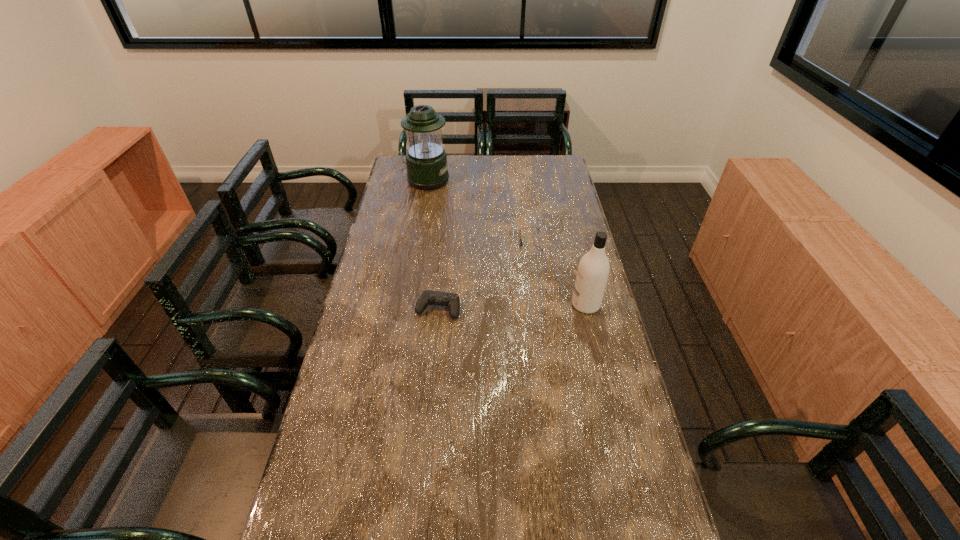
Where is `free space located on the front of the second shortest object`? The image size is (960, 540). free space located on the front of the second shortest object is located at coordinates (434, 351).

Find the location of a particular element. free space located 0.100m on the lenses of the third nearest object is located at coordinates (493, 241).

Where is `vacant space located on the lenses of the third nearest object`? vacant space located on the lenses of the third nearest object is located at coordinates (501, 241).

This screenshot has width=960, height=540. In order to click on blank area located 0.090m on the lenses of the third nearest object in this screenshot , I will do click(x=496, y=241).

Identify the location of object positioned at the far edge. The height and width of the screenshot is (540, 960). (426, 162).

Locate an element on the screen. object positioned at the left edge is located at coordinates (426, 162).

I want to click on object that is positioned at the right edge, so pos(593,270).

Find the location of a particular element. Image resolution: width=960 pixels, height=540 pixels. object situated at the far left corner is located at coordinates (426, 162).

Locate an element on the screen. The image size is (960, 540). free space at the left edge of the desktop is located at coordinates (357, 295).

At what (x,y) coordinates should I click in order to perform the action: click on free point at the right edge. Please return your answer as a coordinate pair (x, y). Looking at the image, I should click on (632, 474).